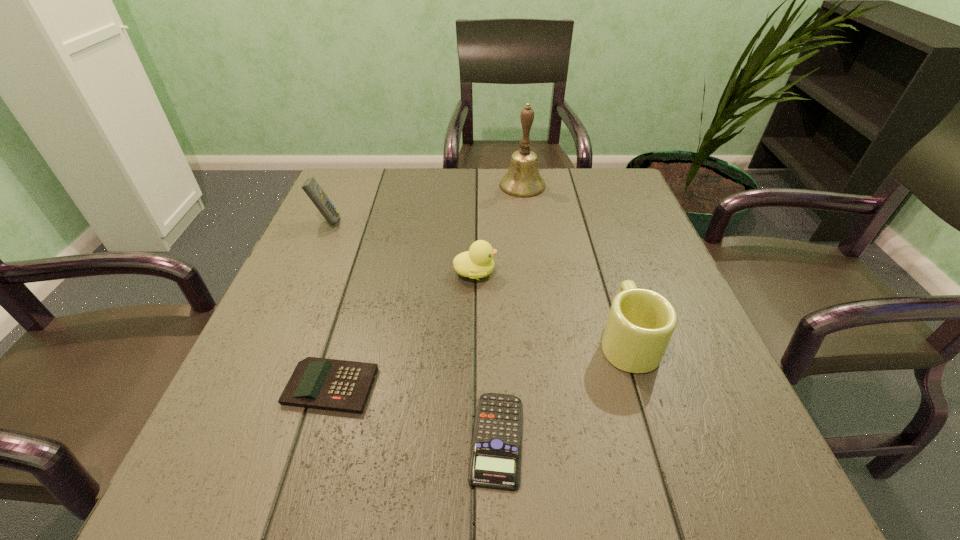
I want to click on the rightmost calculator, so click(495, 460).

Image resolution: width=960 pixels, height=540 pixels. In order to click on vacant area situated on the left of the tallest object in this screenshot , I will do `click(435, 185)`.

Image resolution: width=960 pixels, height=540 pixels. I want to click on free space located on the front-facing side of the farthest calculator, so click(x=453, y=221).

You are a GUI agent. You are given a task and a screenshot of the screen. Output one action in this format:
    pyautogui.click(x=<x>, y=<y>)
    Task: Click on the vacant space situated with the handle on the side of the rightmost object
    The image size is (960, 540).
    Given the screenshot: What is the action you would take?
    pyautogui.click(x=603, y=265)

Where is `free location located with the handle on the side of the rightmost object`? The width and height of the screenshot is (960, 540). free location located with the handle on the side of the rightmost object is located at coordinates (588, 219).

At what (x,y) coordinates should I click in order to perform the action: click on free point located with the handle on the side of the rightmost object. Please return your answer as a coordinate pair (x, y). The width and height of the screenshot is (960, 540). Looking at the image, I should click on (598, 248).

Locate an element on the screen. The image size is (960, 540). free location located 0.360m at the beak of the fourth tallest object is located at coordinates (663, 273).

The image size is (960, 540). Identify the location of vacant point located 0.250m on the back of the second shortest calculator. (366, 268).

You are a GUI agent. You are given a task and a screenshot of the screen. Output one action in this format:
    pyautogui.click(x=<x>, y=<y>)
    Task: Click on the free space located 0.120m on the back of the shortest calculator
    
    Given the screenshot: What is the action you would take?
    pyautogui.click(x=493, y=338)

Image resolution: width=960 pixels, height=540 pixels. In order to click on bell located in the far edge section of the desktop in this screenshot , I will do `click(523, 179)`.